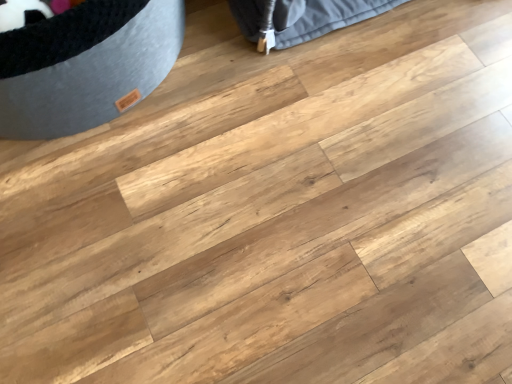
Question: Should I look upward or downward to see gray fabric pet bed at upper left?

Choices:
 (A) down
 (B) up

Answer: (B)